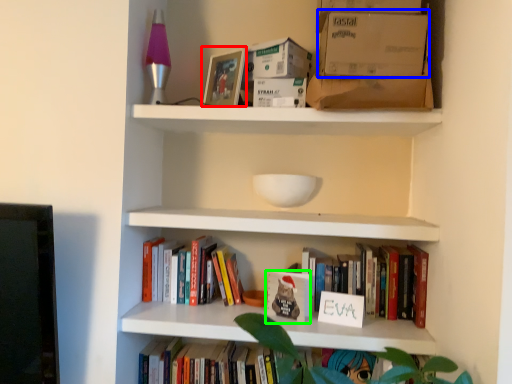
Question: Which is farther away from picture frame (highlighted by a red box)? cardboard box (highlighted by a blue box) or paperback book (highlighted by a green box)?

Choices:
 (A) cardboard box
 (B) paperback book

Answer: (B)